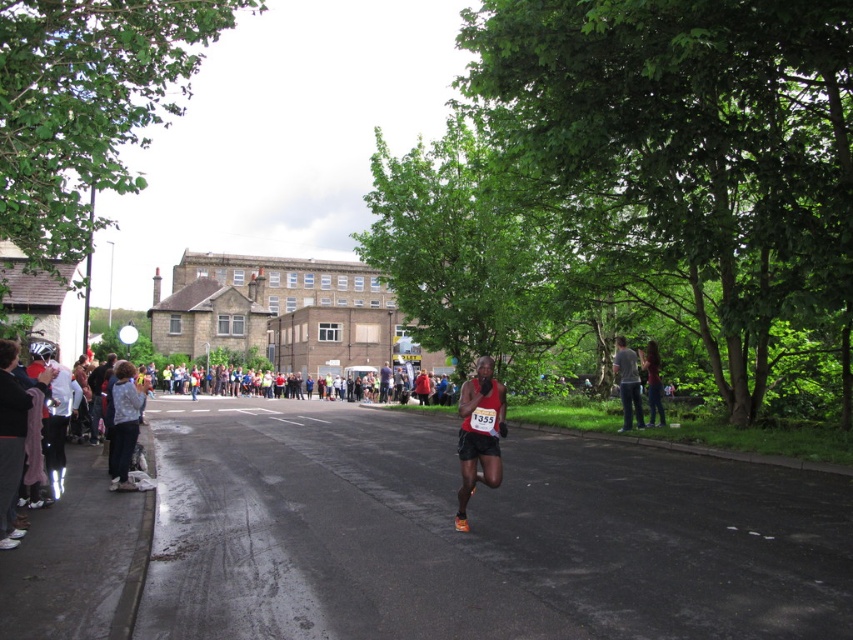
You are a runner in the marathon and you see the black asphalt road at center and the denim jacket at right. Which object is positioned to the left of the other?

The black asphalt road at center is positioned to the left of the denim jacket at right.

In the scene shown: You are a photographer trying to capture the marathon scene. You need to ensure that the black asphalt road at center and the red fabric runner at center are both visible in your shot. Given their sizes, which object should you focus on to frame the shot properly?

The black asphalt road at center has a larger size compared to the red fabric runner at center, so you should focus on framing the shot around the larger black asphalt road at center to ensure both objects are visible.